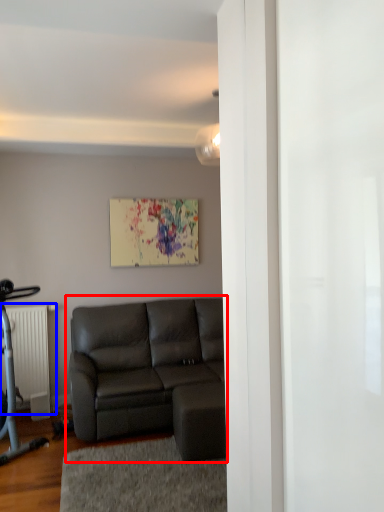
Question: Which object is further to the camera taking this photo, studio couch (highlighted by a red box) or radiator (highlighted by a blue box)?

Choices:
 (A) studio couch
 (B) radiator

Answer: (B)